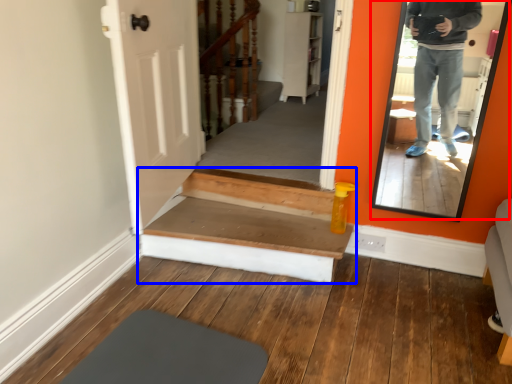
Question: Which object is further to the camera taking this photo, mirror (highlighted by a red box) or stairs (highlighted by a blue box)?

Choices:
 (A) mirror
 (B) stairs

Answer: (B)